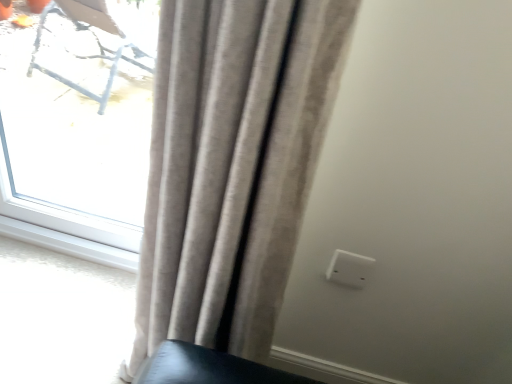
What do you see at coordinates (79, 119) in the screenshot?
I see `transparent glass window at upper left` at bounding box center [79, 119].

Find the location of a particular element. This screenshot has width=512, height=384. transparent glass window at upper left is located at coordinates (79, 119).

You are a GUI agent. You are given a task and a screenshot of the screen. Output one action in this format:
    pyautogui.click(x=<x>, y=<y>)
    Task: Click on the transparent glass window at upper left
    
    Given the screenshot: What is the action you would take?
    pyautogui.click(x=79, y=119)